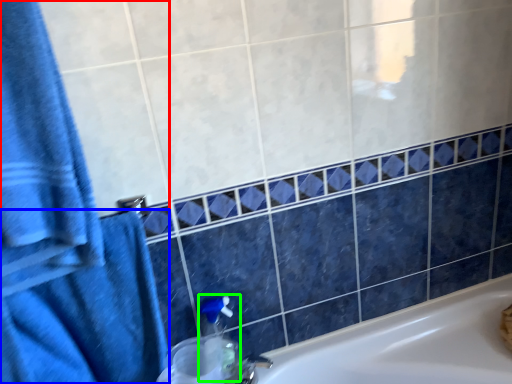
Question: Which is farther away from bath towel (highlighted by a red box)? bath towel (highlighted by a blue box) or soap dispenser (highlighted by a green box)?

Choices:
 (A) bath towel
 (B) soap dispenser

Answer: (B)